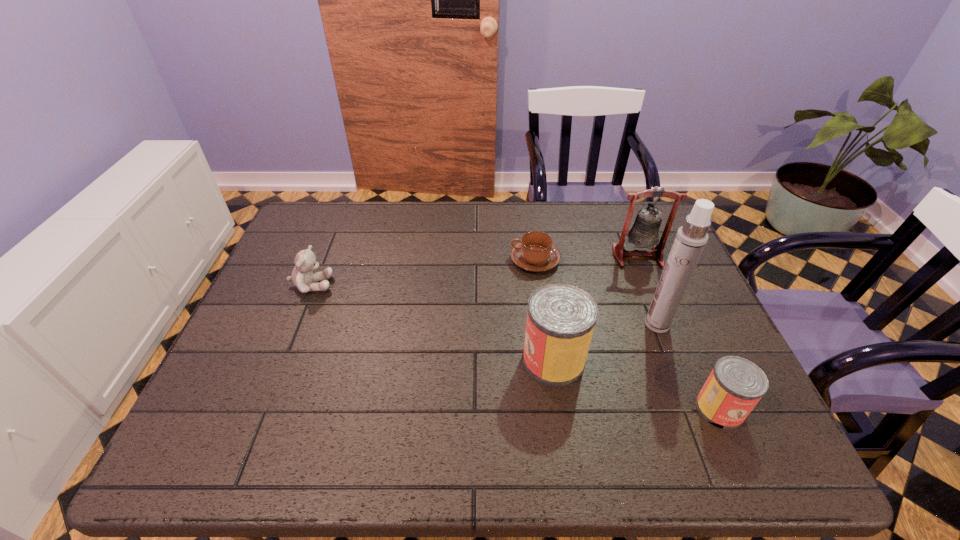
Locate an element on the screen. Image resolution: width=960 pixels, height=540 pixels. object that stands as the third closest to the taller can is located at coordinates (734, 387).

At what (x,y) coordinates should I click in order to perform the action: click on object that is the third closest one to the aerosol can. Please return your answer as a coordinate pair (x, y). The height and width of the screenshot is (540, 960). Looking at the image, I should click on (644, 233).

Locate an element on the screen. vacant region that satisfies the following two spatial constraints: 1. on the back side of the shorter can; 2. on the side of the shortest object with the handle is located at coordinates (655, 260).

Locate an element on the screen. free region that satisfies the following two spatial constraints: 1. on the side of the shorter can with the handle; 2. on the left side of the shortest object is located at coordinates (555, 408).

This screenshot has height=540, width=960. What are the coordinates of `vacant space that satisfies the following two spatial constraints: 1. on the face of the fourth shortest object; 2. on the left side of the leftmost object` in the screenshot? It's located at 281,360.

Where is `free location that satisfies the following two spatial constraints: 1. on the side of the left can with the handle; 2. on the right side of the cappuccino`? free location that satisfies the following two spatial constraints: 1. on the side of the left can with the handle; 2. on the right side of the cappuccino is located at coordinates (548, 360).

You are a GUI agent. You are given a task and a screenshot of the screen. Output one action in this format:
    pyautogui.click(x=<x>, y=<y>)
    Task: Click on the free location that satisfies the following two spatial constraints: 1. on the front side of the bell; 2. on the side of the cappuccino with the handle
    The width and height of the screenshot is (960, 540).
    Given the screenshot: What is the action you would take?
    pyautogui.click(x=639, y=260)

Identify the location of vacant space that satisfies the following two spatial constraints: 1. on the front side of the bell; 2. on the side of the shortest object with the handle. (639, 260).

Image resolution: width=960 pixels, height=540 pixels. I want to click on vacant space that satisfies the following two spatial constraints: 1. on the side of the cappuccino with the handle; 2. on the left side of the nearest object, so click(x=555, y=408).

Locate an element on the screen. This screenshot has height=540, width=960. vacant region that satisfies the following two spatial constraints: 1. on the back side of the second tallest object; 2. on the left side of the second nearest object is located at coordinates (539, 256).